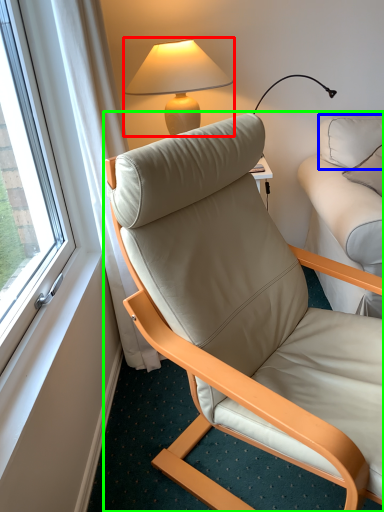
Question: Considering the real-world distances, which object is farthest from lamp (highlighted by a red box)? pillow (highlighted by a blue box) or chair (highlighted by a green box)?

Choices:
 (A) pillow
 (B) chair

Answer: (B)